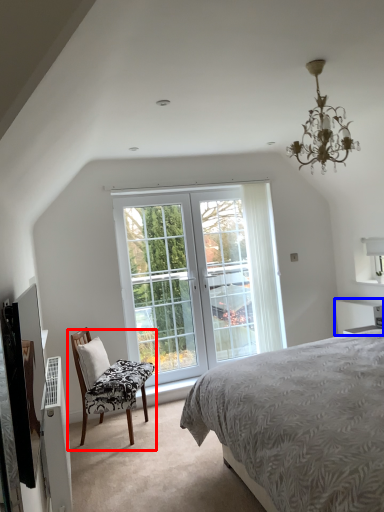
Question: Among these objects, which one is farthest to the camera, chair (highlighted by a red box) or vanity (highlighted by a blue box)?

Choices:
 (A) chair
 (B) vanity

Answer: (B)